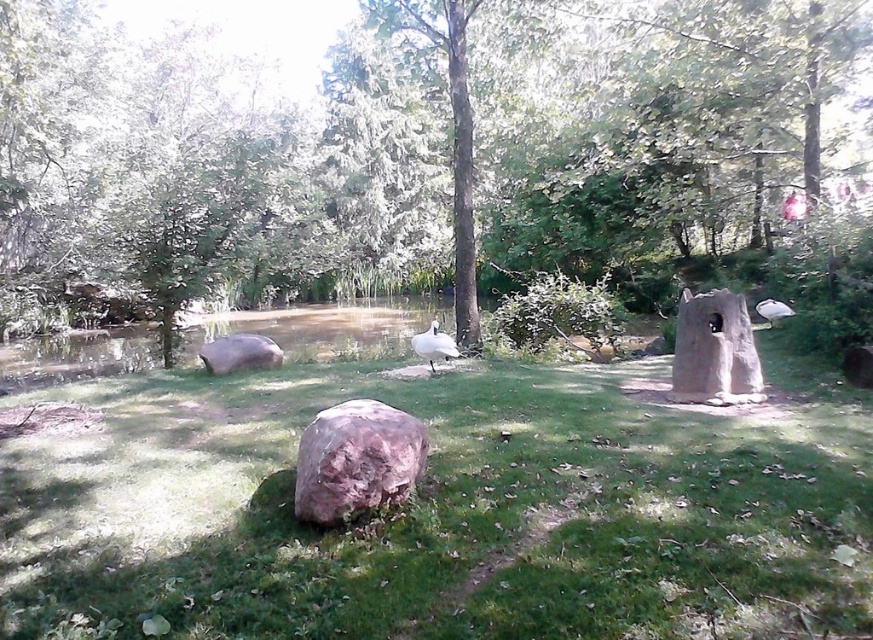
Is rusty stone boulder at center smaller than white glossy bird at upper right?

No.

Based on the photo, does rusty stone boulder at center appear on the left side of white glossy bird at upper right?

Correct, you'll find rusty stone boulder at center to the left of white glossy bird at upper right.

What do you see at coordinates (356, 460) in the screenshot?
I see `rusty stone boulder at center` at bounding box center [356, 460].

Find the location of a particular element. The height and width of the screenshot is (640, 873). rusty stone boulder at center is located at coordinates (356, 460).

Does green leafy tree at center have a greater width compared to green grassy at center?

Yes, green leafy tree at center is wider than green grassy at center.

Is green leafy tree at center bigger than green grassy at center?

Correct, green leafy tree at center is larger in size than green grassy at center.

Between point (552, 129) and point (24, 620), which one is positioned behind?

The point (552, 129) is more distant.

Locate an element on the screen. green leafy tree at center is located at coordinates (407, 152).

Is smooth gray rock at lower left thinner than white matte bird at center?

No.

How much distance is there between smooth gray rock at lower left and white matte bird at center?

smooth gray rock at lower left is 1.91 meters away from white matte bird at center.

At what (x,y) coordinates should I click in order to perform the action: click on smooth gray rock at lower left. Please return your answer as a coordinate pair (x, y). Looking at the image, I should click on (239, 353).

Where is `smooth gray rock at lower left`? The width and height of the screenshot is (873, 640). smooth gray rock at lower left is located at coordinates (239, 353).